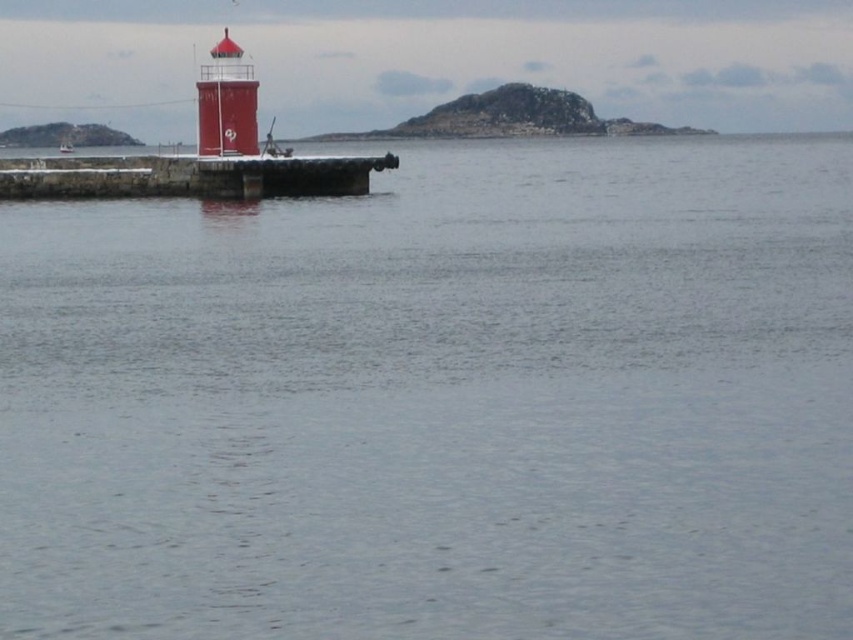
You are a ship captain navigating near the coast. You see the smooth red lighthouse at center. What are the coordinates of the lighthouse to help you plot your course?

The smooth red lighthouse at center is located at coordinates point (225, 102).

You are standing on the smooth stone dock at center and want to reach the smooth red lighthouse at center. In which direction should you walk to get there?

You should walk to the right side since the smooth stone dock at center is positioned on the left side of the smooth red lighthouse at center.

You are standing on the smooth stone dock at center and want to board the metallic silver boat at left. Based on the height difference between the two, will you need a ladder or steps to climb aboard?

The smooth stone dock at center has a lesser height compared to the metallic silver boat at left, so you will need a ladder or steps to climb aboard.